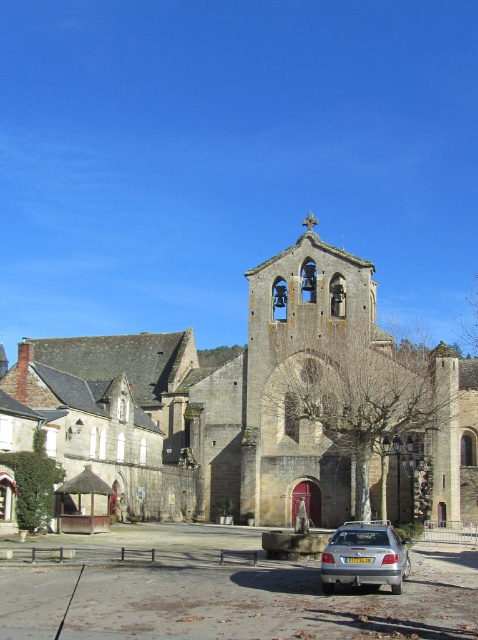
Question: Which point is farther to the camera?

Choices:
 (A) (195, 465)
 (B) (400, 552)

Answer: (A)

Question: Can you confirm if stone church at center is wider than silver metallic car at lower center?

Choices:
 (A) yes
 (B) no

Answer: (A)

Question: Where is stone church at center located in relation to silver metallic car at lower center in the image?

Choices:
 (A) right
 (B) left

Answer: (B)

Question: Does stone church at center appear on the left side of silver metallic car at lower center?

Choices:
 (A) yes
 (B) no

Answer: (A)

Question: Which point is closer to the camera taking this photo?

Choices:
 (A) (279, 333)
 (B) (392, 541)

Answer: (B)